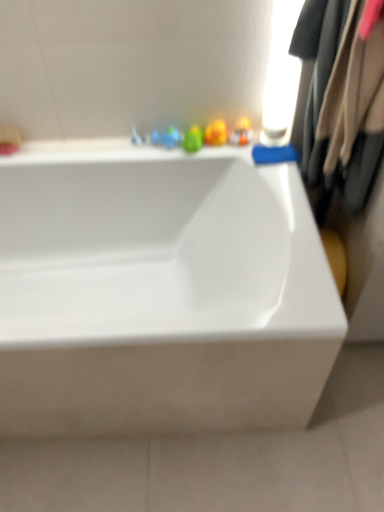
Where is `translucent plastic toy at upper center`? Image resolution: width=384 pixels, height=512 pixels. translucent plastic toy at upper center is located at coordinates (x=241, y=132).

In the scene shown: Can you tell me how much beige fabric coat at right and translucent plastic toy at upper center differ in facing direction?

The angle between the facing direction of beige fabric coat at right and the facing direction of translucent plastic toy at upper center is 88.5 degrees.

Considering the relative sizes of beige fabric coat at right and translucent plastic toy at upper center in the image provided, is beige fabric coat at right wider than translucent plastic toy at upper center?

Indeed, beige fabric coat at right has a greater width compared to translucent plastic toy at upper center.

Can we say beige fabric coat at right lies outside translucent plastic toy at upper center?

Indeed, beige fabric coat at right is completely outside translucent plastic toy at upper center.

In the image, is beige fabric coat at right positioned in front of or behind translucent plastic toy at upper center?

Clearly, beige fabric coat at right is in front of translucent plastic toy at upper center.

Based on the photo, is translucent plastic toy at upper center completely or partially inside white glossy bathtub at center?

No.

Measure the distance between white glossy bathtub at center and translucent plastic toy at upper center.

A distance of 64.38 centimeters exists between white glossy bathtub at center and translucent plastic toy at upper center.

From a real-world perspective, which is physically below, white glossy bathtub at center or translucent plastic toy at upper center?

white glossy bathtub at center, from a real-world perspective.

Can you see white glossy bathtub at center touching translucent plastic toy at upper center?

white glossy bathtub at center and translucent plastic toy at upper center are not in contact.

From the image's perspective, which is above, beige fabric coat at right or white glossy bathtub at center?

beige fabric coat at right appears higher in the image.

Does beige fabric coat at right touch white glossy bathtub at center?

No.

Considering the positions of objects beige fabric coat at right and white glossy bathtub at center in the image provided, who is more to the left, beige fabric coat at right or white glossy bathtub at center?

white glossy bathtub at center is more to the left.

Does beige fabric coat at right have a lesser height compared to white glossy bathtub at center?

Indeed, beige fabric coat at right has a lesser height compared to white glossy bathtub at center.

Which object is closer to the camera, translucent plastic toy at upper center or white glossy bathtub at center?

Result: white glossy bathtub at center is closer to the camera.

Is translucent plastic toy at upper center wider or thinner than white glossy bathtub at center?

In the image, translucent plastic toy at upper center appears to be more narrow than white glossy bathtub at center.

Is translucent plastic toy at upper center oriented towards white glossy bathtub at center?

No.

How distant is white glossy bathtub at center from beige fabric coat at right?

white glossy bathtub at center and beige fabric coat at right are 21.65 inches apart from each other.

From the image's perspective, which one is positioned higher, white glossy bathtub at center or beige fabric coat at right?

beige fabric coat at right is shown above in the image.

How different are the orientations of white glossy bathtub at center and beige fabric coat at right in degrees?

The angle between the facing direction of white glossy bathtub at center and the facing direction of beige fabric coat at right is 88.3 degrees.

Does white glossy bathtub at center lie behind beige fabric coat at right?

Yes, it is.

From a real-world perspective, which object stands above the other?

beige fabric coat at right, from a real-world perspective.

Is translucent plastic toy at upper center positioned in front of beige fabric coat at right?

No, translucent plastic toy at upper center is behind beige fabric coat at right.

Does point (240, 133) appear closer or farther from the camera than point (368, 37)?

Point (240, 133) is farther from the camera than point (368, 37).

Do you think translucent plastic toy at upper center is within beige fabric coat at right, or outside of it?

translucent plastic toy at upper center cannot be found inside beige fabric coat at right.

Locate an element on the screen. toy located above the beige fabric coat at right (from the image's perspective) is located at coordinates (241, 132).

Identify the location of toy lying behind the white glossy bathtub at center. (241, 132).

Looking at the image, which one is located closer to white glossy bathtub at center, translucent plastic toy at upper center or beige fabric coat at right?

beige fabric coat at right lies closer to white glossy bathtub at center than the other object.

Considering their positions, is translucent plastic toy at upper center positioned further to beige fabric coat at right than white glossy bathtub at center?

white glossy bathtub at center lies further to beige fabric coat at right than the other object.

Estimate the real-world distances between objects in this image. Which object is further from translucent plastic toy at upper center, white glossy bathtub at center or beige fabric coat at right?

white glossy bathtub at center lies further to translucent plastic toy at upper center than the other object.

From the image, which object appears to be farther from white glossy bathtub at center, beige fabric coat at right or translucent plastic toy at upper center?

translucent plastic toy at upper center lies further to white glossy bathtub at center than the other object.

When comparing their distances from translucent plastic toy at upper center, does beige fabric coat at right or white glossy bathtub at center seem further?

white glossy bathtub at center is positioned further to the anchor translucent plastic toy at upper center.

When comparing their distances from beige fabric coat at right, does white glossy bathtub at center or translucent plastic toy at upper center seem closer?

translucent plastic toy at upper center.

You are a GUI agent. You are given a task and a screenshot of the screen. Output one action in this format:
    pyautogui.click(x=<x>, y=<y>)
    Task: Click on the bathtub positioned between beige fabric coat at right and translucent plastic toy at upper center from near to far
    The image size is (384, 512).
    Given the screenshot: What is the action you would take?
    pyautogui.click(x=159, y=292)